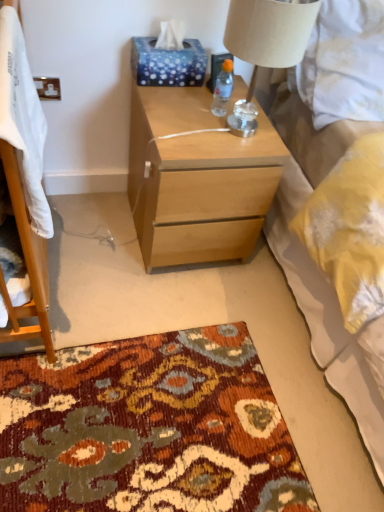
Question: From the image's perspective, relative to transparent plastic bottle at upper center, is blue dotted tissue at upper center above or below?

Choices:
 (A) below
 (B) above

Answer: (B)

Question: Relative to transparent plastic bottle at upper center, is blue dotted tissue at upper center in front or behind?

Choices:
 (A) front
 (B) behind

Answer: (B)

Question: Based on their relative distances, which object is farther from the beige fabric lampshade at upper right?

Choices:
 (A) light wood/finish nightstand at center
 (B) transparent plastic bottle at upper center
 (C) white textured bed at upper right
 (D) blue dotted tissue at upper center
 (E) white plastic power outlet at upper left

Answer: (E)

Question: Which of these objects is positioned farthest from the white textured bed at upper right?

Choices:
 (A) transparent plastic bottle at upper center
 (B) blue dotted tissue at upper center
 (C) beige fabric lampshade at upper right
 (D) white plastic power outlet at upper left
 (E) white soft blanket at left

Answer: (D)